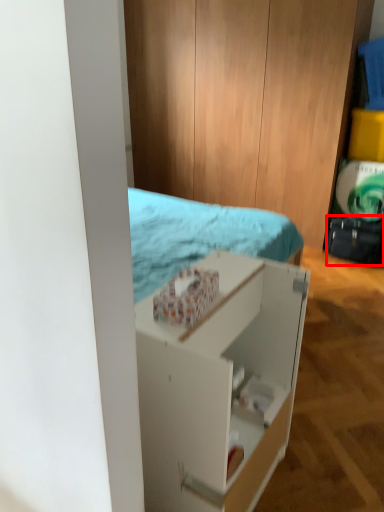
Question: From the image's perspective, what is the correct spatial relationship of luggage (annotated by the red box) in relation to shelf?

Choices:
 (A) above
 (B) below

Answer: (A)